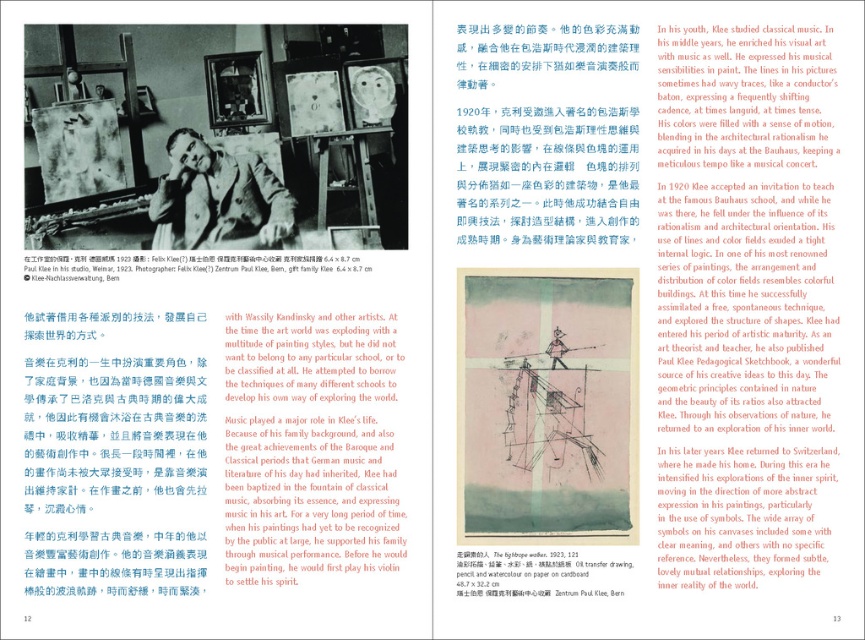
Question: Does watercolor paper at center have a lesser width compared to oil transfer drawing, pencil and watercolor paper on cardboard at center?

Choices:
 (A) yes
 (B) no

Answer: (B)

Question: Which point is closer to the camera?

Choices:
 (A) oil transfer drawing, pencil and watercolor paper on cardboard at center
 (B) watercolor paper at center
 (C) oil transfer drawing at upper center

Answer: (A)

Question: Considering the real-world distances, which object is farthest from the watercolor paper at center?

Choices:
 (A) matte black photograph at upper left
 (B) oil transfer drawing, pencil and watercolor paper on cardboard at center
 (C) oil transfer drawing at upper center

Answer: (C)

Question: Does oil transfer drawing at upper center appear on the right side of matte black photograph at upper left?

Choices:
 (A) yes
 (B) no

Answer: (B)

Question: From the image, what is the correct spatial relationship of matte black photograph at upper left in relation to oil transfer drawing, pencil and watercolor paper on cardboard at center?

Choices:
 (A) above
 (B) below

Answer: (A)

Question: Estimate the real-world distances between objects in this image. Which object is closer to the matte black photograph at upper left?

Choices:
 (A) oil transfer drawing at upper center
 (B) watercolor paper at center

Answer: (A)